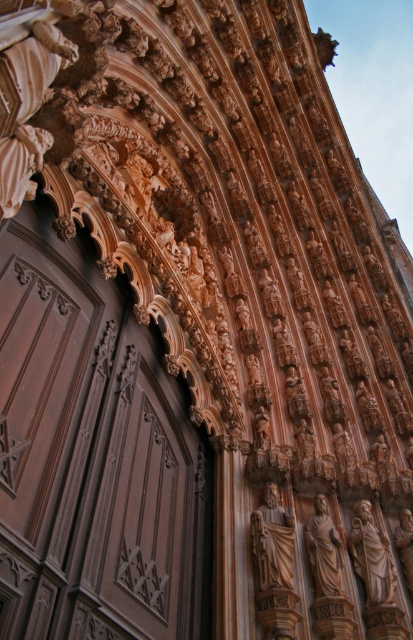
Who is more forward, (x=370, y=596) or (x=332, y=417)?

Point (x=370, y=596)

Image resolution: width=413 pixels, height=640 pixels. Describe the element at coordinates (372, 556) in the screenshot. I see `polished brown statue at center` at that location.

Is point (394, 588) closer to viewer compared to point (325, 380)?

Yes, it is in front of point (325, 380).

Locate an element on the screen. This screenshot has width=413, height=640. polished brown statue at center is located at coordinates (372, 556).

Between polished beige statue at center and polished bronze statue at center, which one has more height?

polished beige statue at center is taller.

Is polished beige statue at center further to the viewer compared to polished bronze statue at center?

No, polished beige statue at center is in front of polished bronze statue at center.

Between point (261, 524) and point (341, 408), which one is positioned behind?

Positioned behind is point (341, 408).

Find the location of a particular element. Image resolution: width=413 pixels, height=640 pixels. polished beige statue at center is located at coordinates (272, 540).

Which is more to the left, polished brown statue at center or smooth beige statue at center?

smooth beige statue at center

Which of these two, polished brown statue at center or smooth beige statue at center, stands shorter?

smooth beige statue at center is shorter.

Is point (372, 563) behind point (337, 532)?

No, it is not.

Identify the location of polished brown statue at center. Image resolution: width=413 pixels, height=640 pixels. (372, 556).